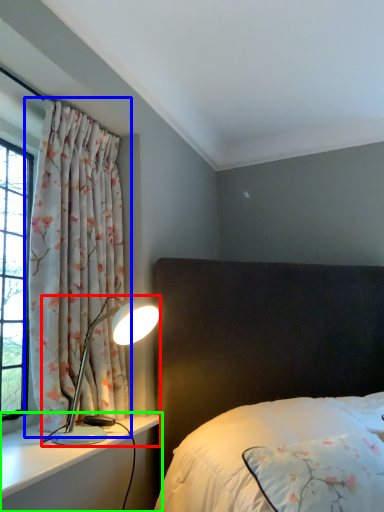
Question: Which object is the farthest from lamp (highlighted by a red box)? Choose among these: curtain (highlighted by a blue box) or dresser (highlighted by a green box).

Choices:
 (A) curtain
 (B) dresser

Answer: (A)